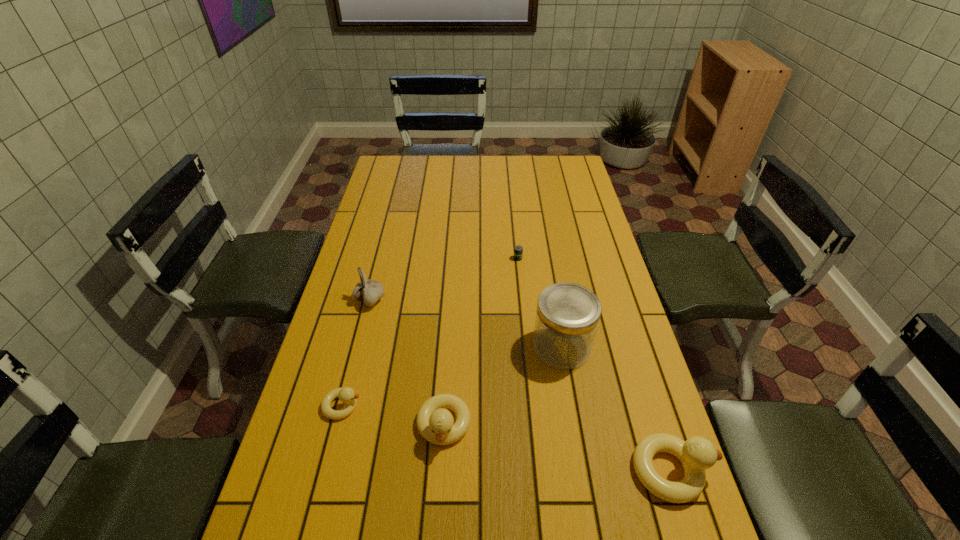
In order to click on the fifth tallest object in this screenshot , I will do `click(346, 395)`.

The image size is (960, 540). I want to click on the shortest duckling, so click(346, 395).

I want to click on the second shortest duckling, so click(435, 424).

This screenshot has width=960, height=540. I want to click on the fourth object from right to left, so click(x=435, y=424).

Identify the location of the rightmost duckling. This screenshot has width=960, height=540. (697, 454).

Locate an element on the screen. This screenshot has width=960, height=540. the shortest object is located at coordinates (518, 251).

Identify the location of the farthest object. (518, 251).

At what (x,y) coordinates should I click in order to perform the action: click on garlic. Please return your answer as a coordinate pair (x, y). This screenshot has height=540, width=960. Looking at the image, I should click on (369, 291).

The height and width of the screenshot is (540, 960). What are the coordinates of `jar` in the screenshot? It's located at (567, 317).

At what (x,y) coordinates should I click in order to perform the action: click on the tallest object. Please return your answer as a coordinate pair (x, y). The image size is (960, 540). Looking at the image, I should click on (567, 317).